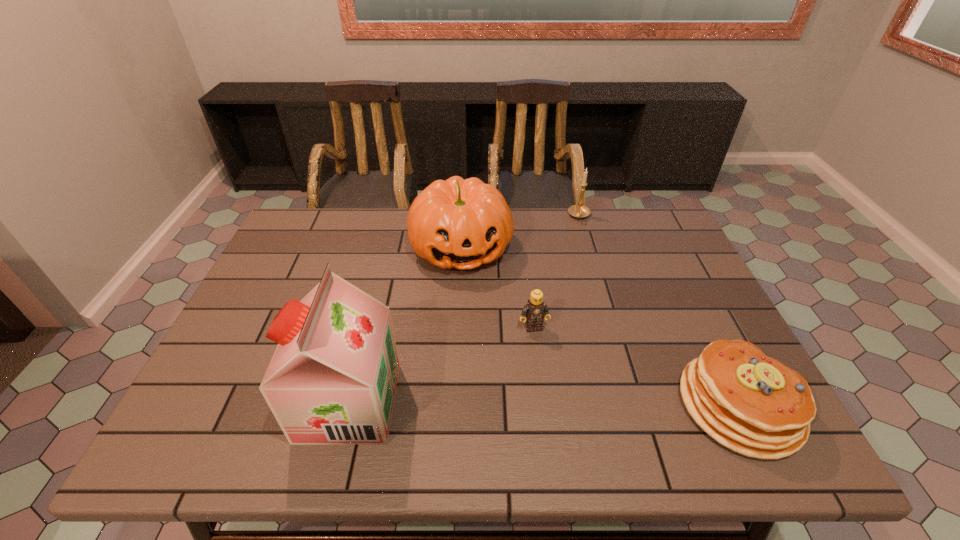
Locate an element on the screen. The width and height of the screenshot is (960, 540). vacant space on the desktop that is between the soya milk and the rightmost object and is positioned on the carved face of the pumpkin is located at coordinates [502, 403].

Find the location of `free space on the desktop that is between the tallest object and the pancake and is positioned in front of the third farthest object`. free space on the desktop that is between the tallest object and the pancake and is positioned in front of the third farthest object is located at coordinates (556, 404).

Identify the location of vacant spot on the desktop that is between the tallest object and the rightmost object and is positioned on the handle side of the candle holder. (588, 404).